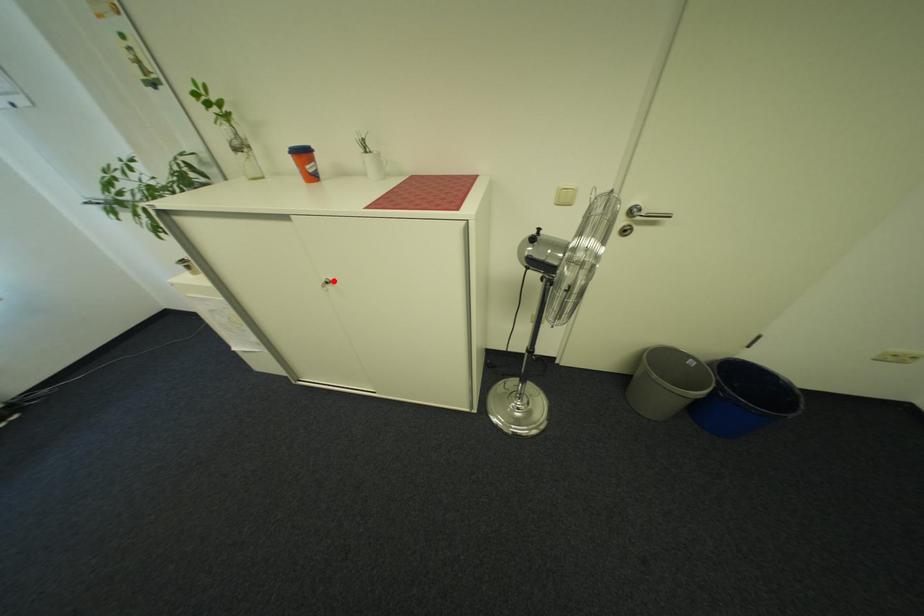
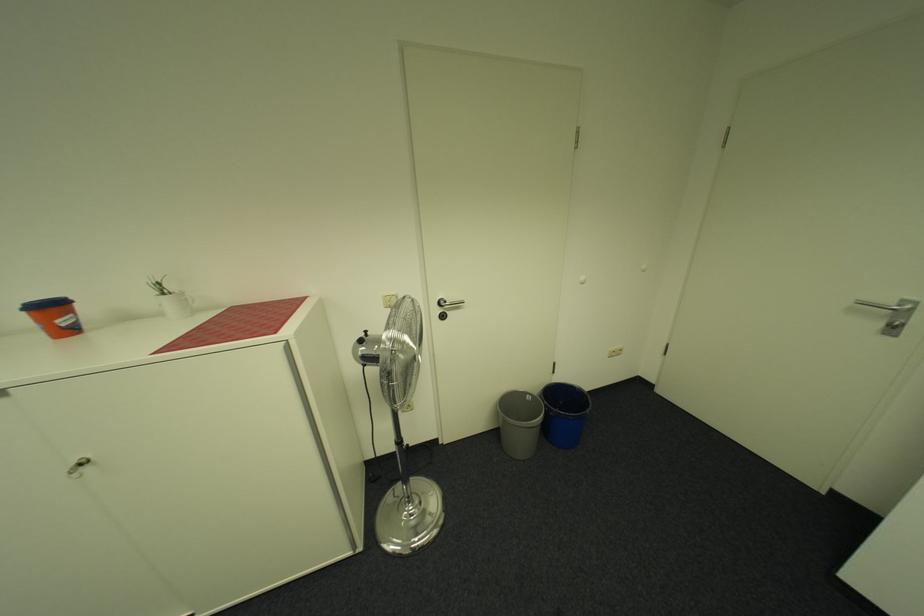
Find the pixel in the second image that matches the highlighted location in the first image.

(83, 464)